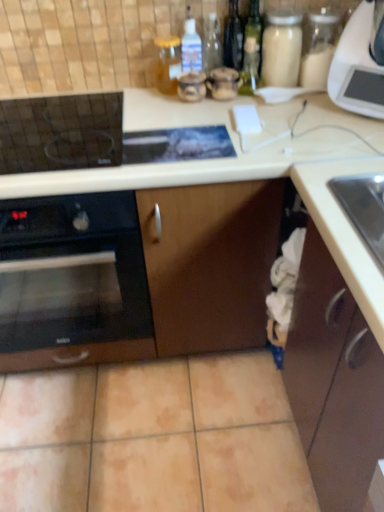
Where is `vacant area situated to the left side of white plastic microwave at upper right`? This screenshot has width=384, height=512. vacant area situated to the left side of white plastic microwave at upper right is located at coordinates (292, 112).